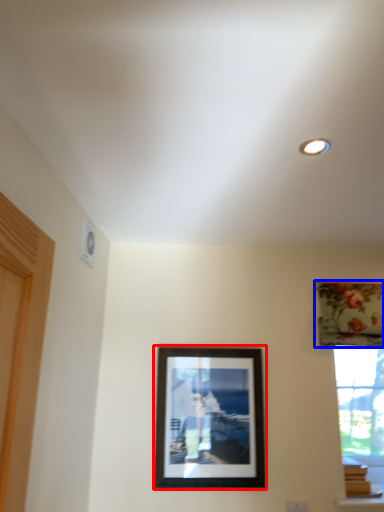
Question: Among these objects, which one is farthest to the camera, picture frame (highlighted by a red box) or curtain (highlighted by a blue box)?

Choices:
 (A) picture frame
 (B) curtain

Answer: (B)